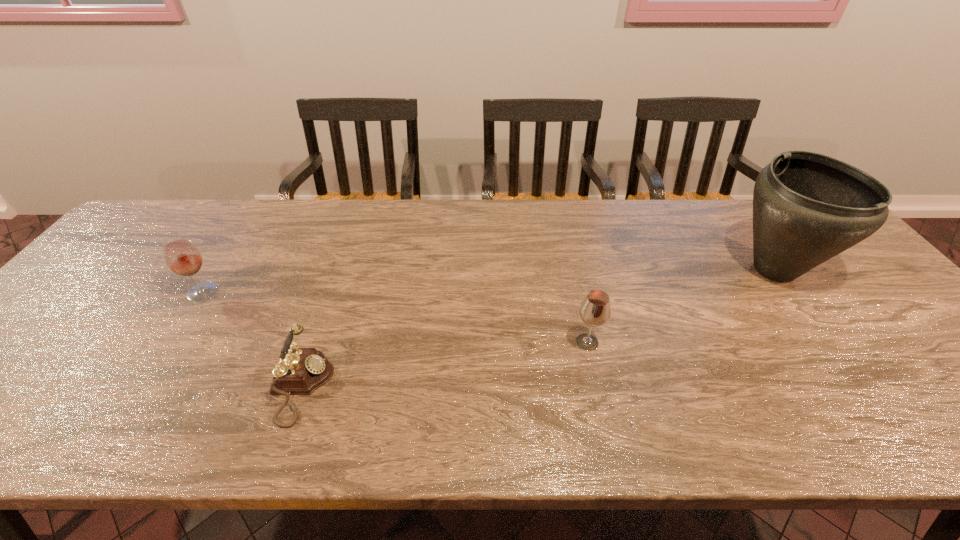
Locate an element on the screen. This screenshot has height=540, width=960. vacant area situated 0.260m on the right of the right wineglass is located at coordinates (712, 342).

Identify the location of free space located 0.290m on the dial of the third object from right to left. (465, 386).

The image size is (960, 540). What are the coordinates of `object that is at the far edge` in the screenshot? It's located at (807, 207).

This screenshot has width=960, height=540. In order to click on object that is positioned at the near edge in this screenshot , I will do `click(300, 371)`.

Find the location of a particular element. This screenshot has height=540, width=960. object that is at the right edge is located at coordinates (807, 207).

You are a GUI agent. You are given a task and a screenshot of the screen. Output one action in this format:
    pyautogui.click(x=<x>, y=<y>)
    Task: Click on the object that is at the far right corner
    This screenshot has height=540, width=960.
    Given the screenshot: What is the action you would take?
    pyautogui.click(x=807, y=207)

You are a GUI agent. You are given a task and a screenshot of the screen. Output one action in this format:
    pyautogui.click(x=<x>, y=<y>)
    Task: Click on the free space at the far edge of the desktop
    
    Given the screenshot: What is the action you would take?
    pyautogui.click(x=327, y=241)

Locate an element on the screen. vacant space at the near edge of the desktop is located at coordinates (365, 416).

What are the coordinates of `vacant space at the right edge of the desktop` in the screenshot? It's located at (922, 364).

The width and height of the screenshot is (960, 540). I want to click on empty space between the urn and the second object from left to right, so click(x=538, y=328).